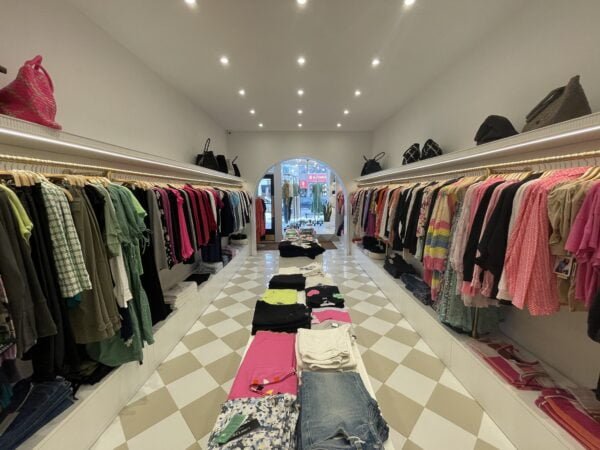
In order to click on display tables in this screenshot , I will do `click(295, 242)`, `click(306, 290)`, `click(319, 405)`.